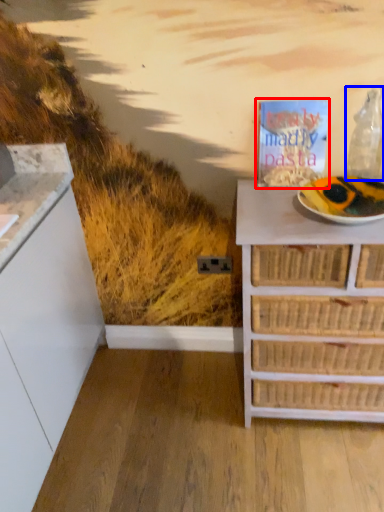
Question: Which of the following is the closest to the observer, magazine (highlighted by a red box) or wine bottle (highlighted by a blue box)?

Choices:
 (A) magazine
 (B) wine bottle

Answer: (B)